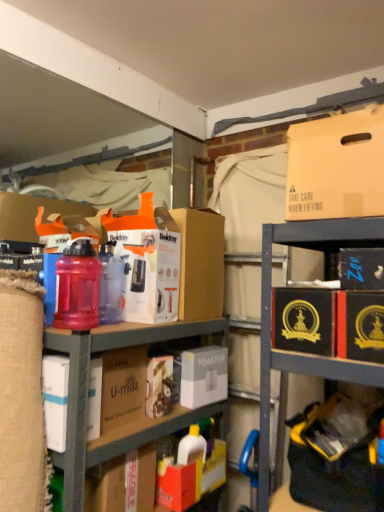
Question: Is gold embossed box at right, placed as the second cardboard box when sorted from left to right, wider or thinner than white matte toaster at center, which is the third storage box in right-to-left order?

Choices:
 (A) wide
 (B) thin

Answer: (A)

Question: Do you think gold embossed box at right, which appears as the first cardboard box when viewed from the front, is within white matte toaster at center, which is the third storage box in right-to-left order, or outside of it?

Choices:
 (A) inside
 (B) outside

Answer: (B)

Question: Which object is positioned farthest from the matte cardboard box at upper right?

Choices:
 (A) black cardboard box at upper right, the third storage box ordered from the bottom
 (B) orange matte cardboard box at center, arranged as the first cardboard box when viewed from the back
 (C) matte plastic bottles at center
 (D) white matte toaster at center, which ranks as the 1th storage box in bottom-to-top order
 (E) black cardboard box at lower right, which ranks as the 1th storage box in right-to-left order

Answer: (D)

Question: Estimate the real-world distances between objects in this image. Which object is farther from the translucent plastic water bottle at left?

Choices:
 (A) gold embossed box at right, the first cardboard box positioned from the right
 (B) orange matte cardboard box at center, arranged as the first cardboard box when viewed from the back
 (C) white matte toaster at center, arranged as the 3th storage box when viewed from the top
 (D) matte plastic bottles at center
 (E) matte cardboard box at upper right

Answer: (E)